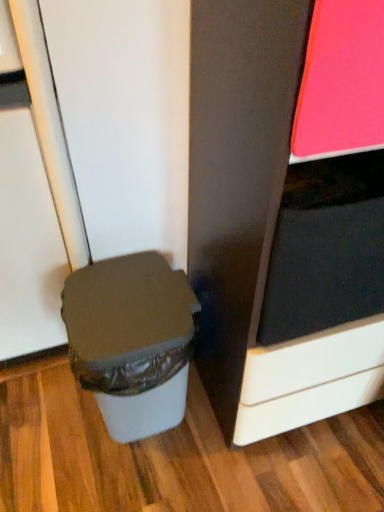
At what (x,y) coordinates should I click in order to perform the action: click on empty space that is ontop of white plastic waste bin at lower left. Please return your answer as a coordinate pair (x, y). The width and height of the screenshot is (384, 512). Looking at the image, I should click on [x=126, y=310].